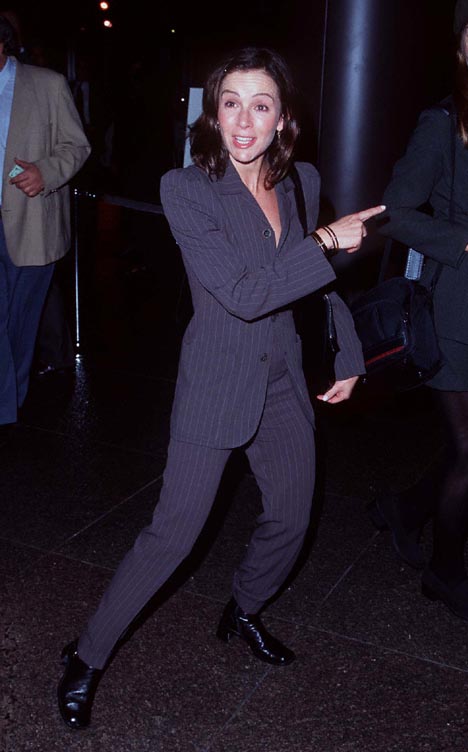
This screenshot has height=752, width=468. Find the location of `floor`. floor is located at coordinates coord(19,653).